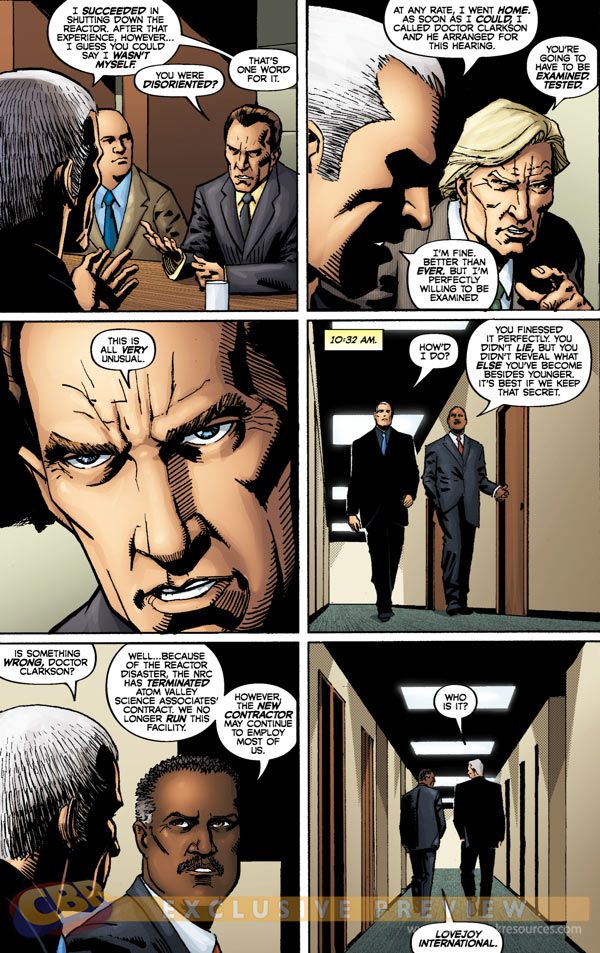
Where is `cup`? This screenshot has height=953, width=600. cup is located at coordinates (212, 287).